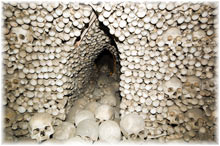
The height and width of the screenshot is (146, 220). I want to click on wall to right of tunnel, so click(x=140, y=70).